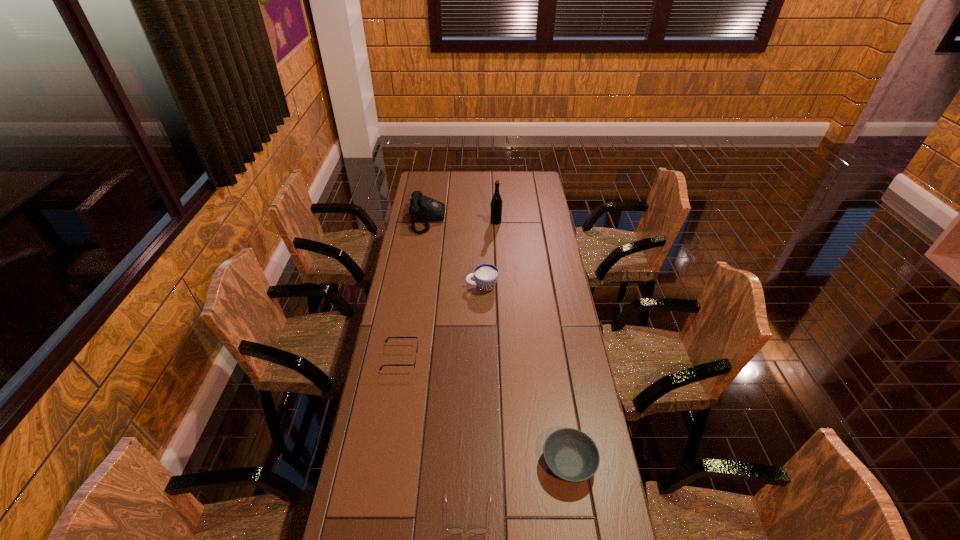
Locate an element on the screen. The width and height of the screenshot is (960, 540). vacant area situated 0.100m on the right of the beer bottle is located at coordinates (521, 222).

I want to click on vacant region located on the dial of the second tallest object, so (519, 220).

The image size is (960, 540). I want to click on free space located on the side of the fourth nearest object with the handle, so click(433, 286).

Find the location of a particular element. The image size is (960, 540). vacant space located 0.120m on the side of the fourth nearest object with the handle is located at coordinates (438, 286).

Identify the location of vacant space positioned on the side of the fourth nearest object with the handle. (428, 286).

This screenshot has height=540, width=960. In order to click on free location located on the left of the second nearest object in this screenshot , I will do `click(427, 463)`.

At what (x,y) coordinates should I click in order to perform the action: click on free spot located 0.260m at the hinge ends of the farther spectacles. Please return your answer as a coordinate pair (x, y). Looking at the image, I should click on (491, 357).

Where is `telephone that is at the left edge`? This screenshot has width=960, height=540. telephone that is at the left edge is located at coordinates (424, 209).

The height and width of the screenshot is (540, 960). In order to click on spectacles present at the left edge in this screenshot , I will do `click(414, 364)`.

Locate an element on the screen. Image resolution: width=960 pixels, height=540 pixels. object that is at the right edge is located at coordinates (571, 455).